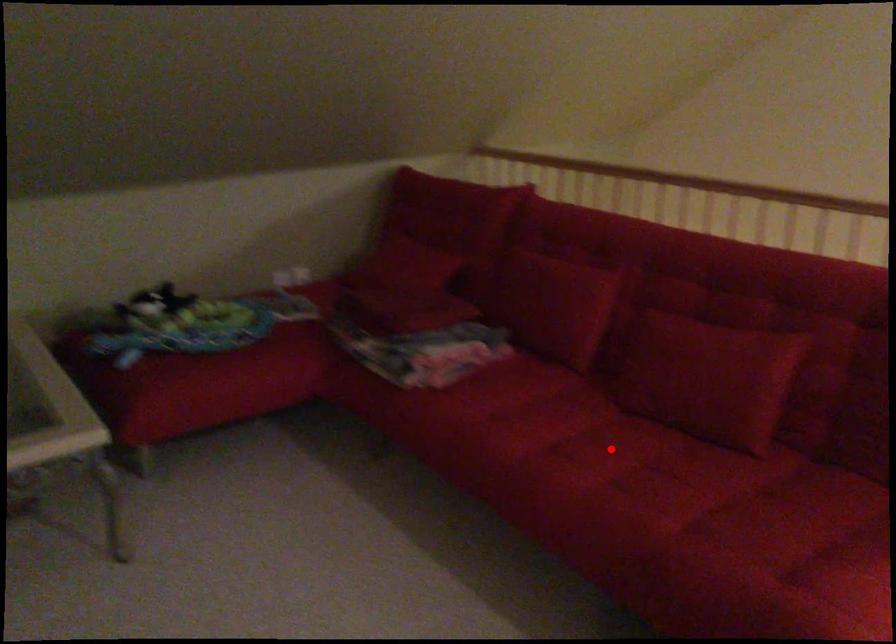
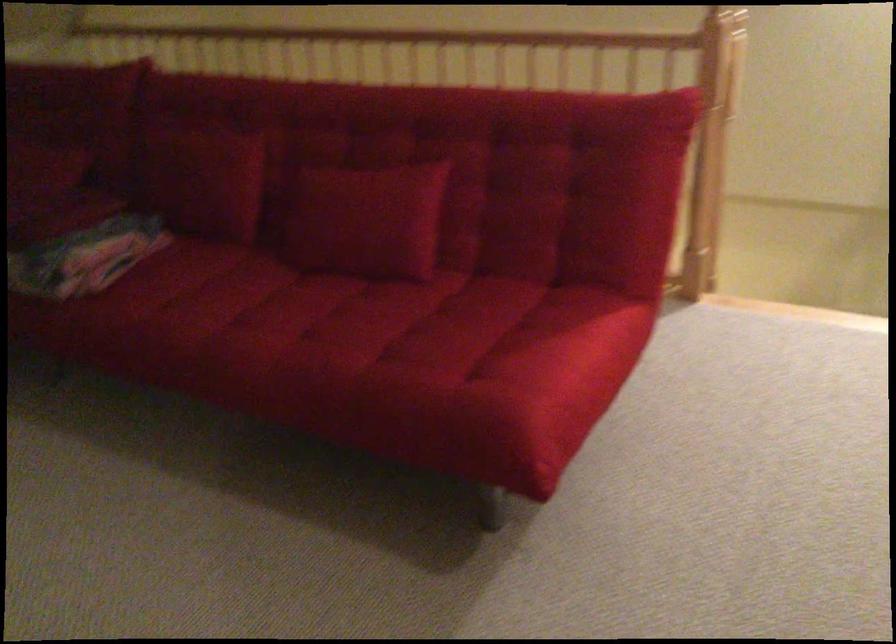
Locate, in the second image, the point that corresponds to the highlighted location in the first image.

(290, 310)